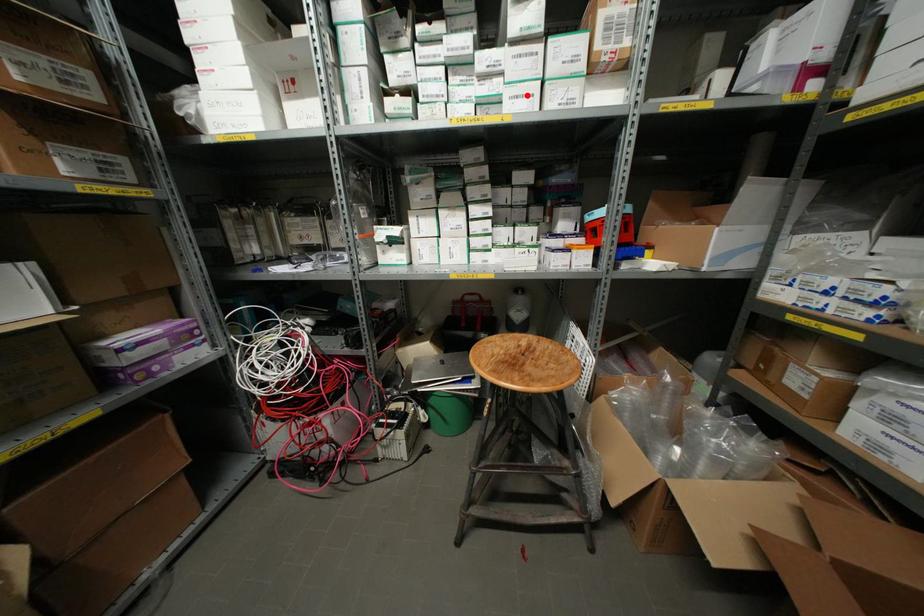
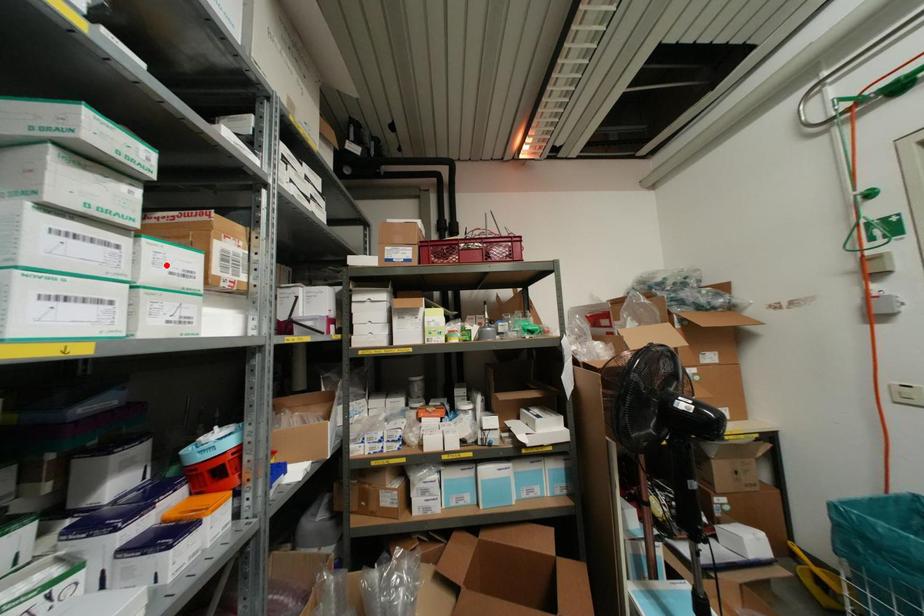
I am providing you with two images of the same scene from different viewpoints. A red point is marked on the first image and another point is marked on the second image. Do the highlighted points in image1 and image2 indicate the same real-world spot?

No